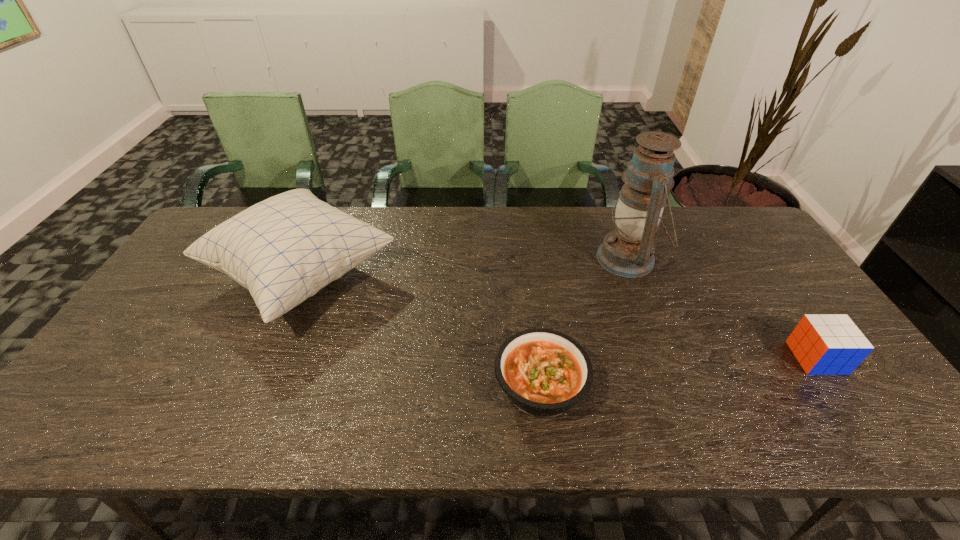
The width and height of the screenshot is (960, 540). Identify the location of vacant area that lies between the leftmost object and the rightmost object. (559, 316).

Identify the location of vacant space that's between the cube and the stew. This screenshot has width=960, height=540. (679, 372).

At what (x,y) coordinates should I click in order to perform the action: click on free space between the leftmost object and the stew. Please return your answer as a coordinate pair (x, y). Looking at the image, I should click on (421, 330).

Where is `empty location between the tallest object and the rightmost object`? The width and height of the screenshot is (960, 540). empty location between the tallest object and the rightmost object is located at coordinates (722, 308).

This screenshot has width=960, height=540. In order to click on the closest object to the tallest object in this screenshot , I will do `click(544, 372)`.

Select which object appears as the third closest to the tallest object. Please provide its 2D coordinates. Your answer should be formatted as a tuple, i.e. [(x, y)], where the tuple contains the x and y coordinates of a point satisfying the conditions above.

[(284, 249)]

Find the location of a particular element. The width and height of the screenshot is (960, 540). free spot that satisfies the following two spatial constraints: 1. on the front side of the leftmost object; 2. on the left side of the stew is located at coordinates (254, 385).

Identify the location of free point that satisfies the following two spatial constraints: 1. on the front side of the rightmost object; 2. on the left side of the third object from left to right. (665, 357).

This screenshot has width=960, height=540. Identify the location of vacant region that satisfies the following two spatial constraints: 1. on the back side of the third object from right to left; 2. on the right side of the rightmost object. (538, 357).

Locate an element on the screen. The width and height of the screenshot is (960, 540). free point that satisfies the following two spatial constraints: 1. on the front side of the stew; 2. on the left side of the third shortest object is located at coordinates (254, 385).